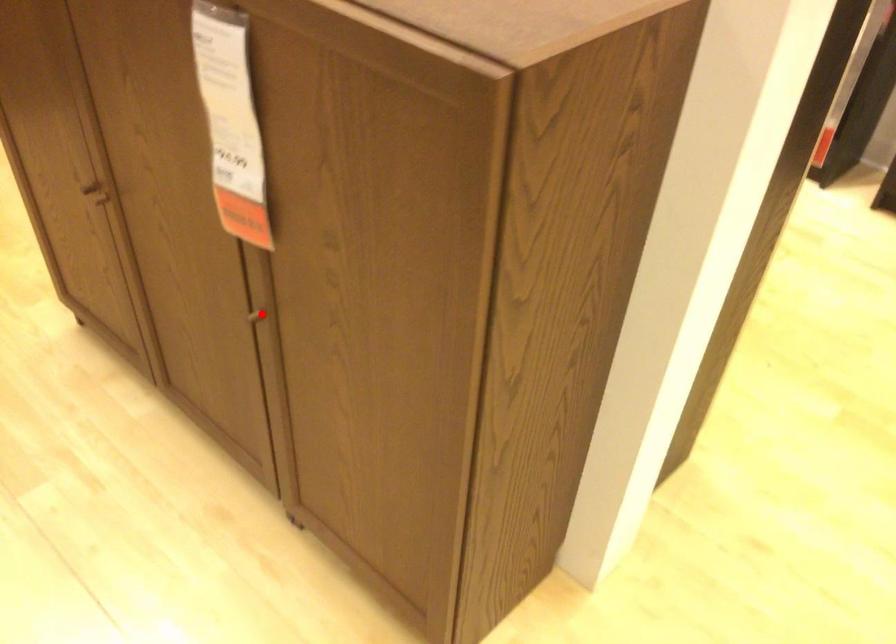
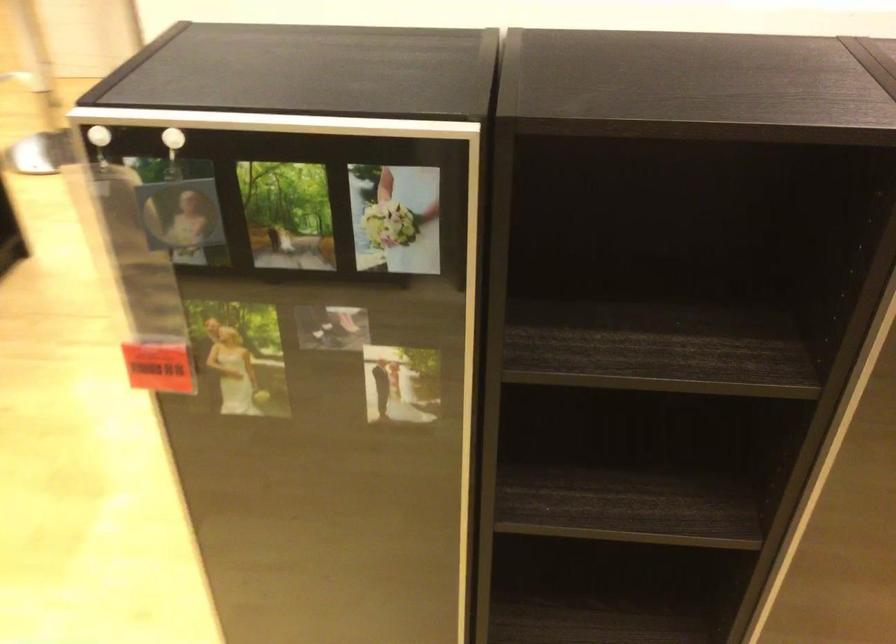
Question: I am providing you with two images of the same scene from different viewpoints. A red point is marked on the first image. At the location where the point appears in image 1, is it still visible in image 2?

Choices:
 (A) Yes
 (B) No

Answer: (B)